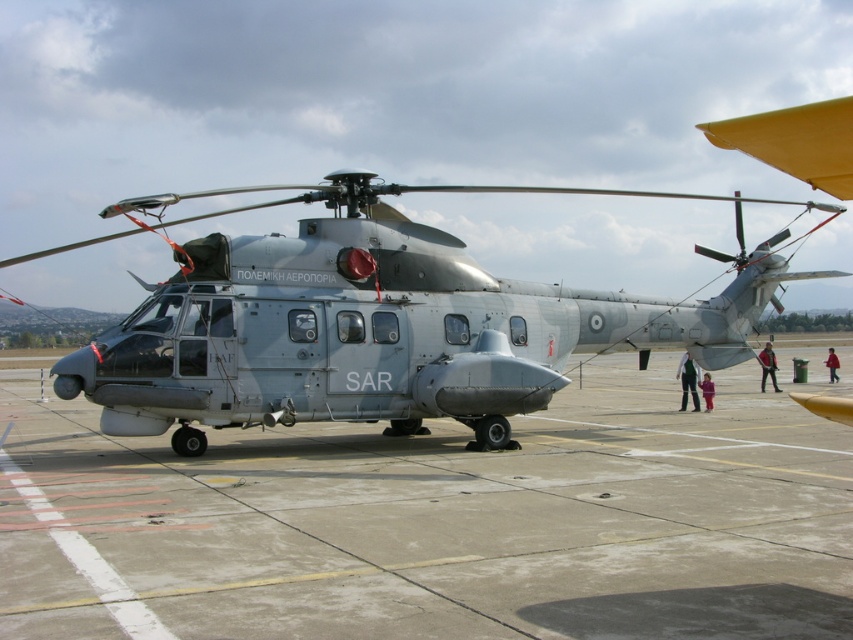
You are a photographer trying to capture the SAR helicopter. You notice the gray concrete tarmac at center and the red cotton jacket at lower right in your frame. Which object should you focus on first if you want to ensure both are in focus?

You should focus on the gray concrete tarmac at center first because it is closer to the viewer than the red cotton jacket at lower right. By focusing on the closer object, the farther object may still be within the depth of field, ensuring both are in focus.

You are a maintenance worker at the Hellenic Air Force base. You need to place a heavy equipment box on the ground near the gray concrete tarmac at center and the black fabric jacket at lower right. Which object should you place the box on to ensure it stays stable?

The gray concrete tarmac at center has a lesser height compared to the black fabric jacket at lower right, so placing the box on the gray concrete tarmac at center would ensure stability as it is a solid and level surface.